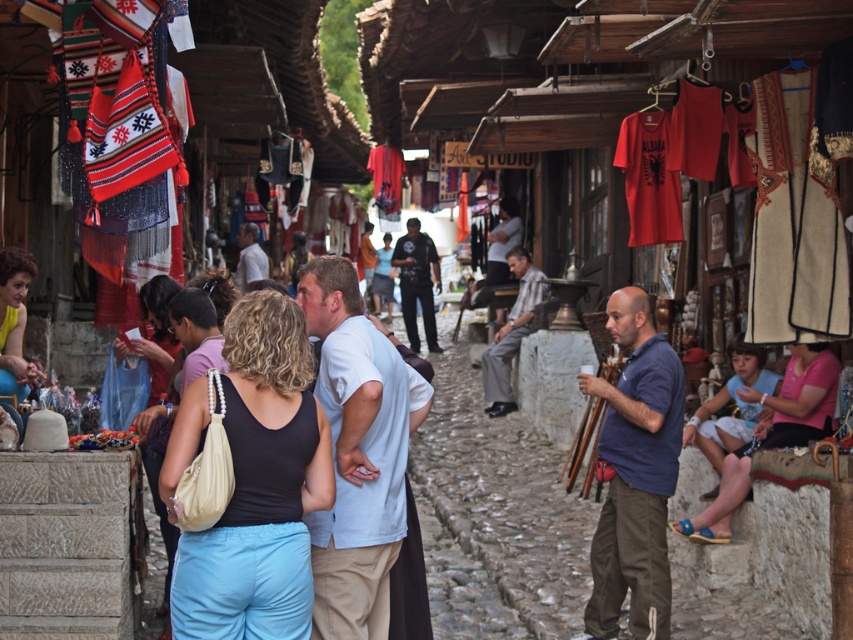
Question: Is black fabric tank top at center positioned in front of yellow fabric blouse at center?

Choices:
 (A) yes
 (B) no

Answer: (A)

Question: Which point is farther from the camera taking this photo?

Choices:
 (A) (801, 346)
 (B) (24, 360)
 (C) (165, 301)
 (D) (311, 604)

Answer: (B)

Question: Where is denim shorts at lower right located in relation to matte black tank top at center in the image?

Choices:
 (A) left
 (B) right

Answer: (B)

Question: Is black fabric tank top at center behind matte black tank top at center?

Choices:
 (A) yes
 (B) no

Answer: (B)

Question: Which of the following is the closest to the observer?

Choices:
 (A) (802, 400)
 (B) (30, 364)
 (C) (245, 490)
 (D) (148, 284)

Answer: (C)

Question: Which object is farther from the camera taking this photo?

Choices:
 (A) black fabric tank top at center
 (B) matte black tank top at center
 (C) denim shorts at lower right
 (D) yellow fabric blouse at center

Answer: (C)